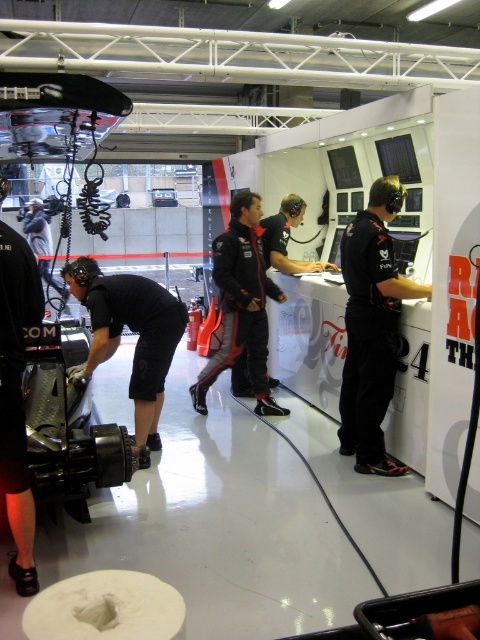
You are a race car driver who just finished a practice lap and need to locate the black matte mechanic at lower left for a quick consultation. Based on the coordinates provided, where should you look to find them?

The black matte mechanic at lower left is located at coordinates point (132, 330), so you should look towards the lower left area of the scene to find them.

You are a spectator at the race event and want to take a photo of the black matte suit at right and the black matte mechanic at lower left. To ensure both are in frame, should you adjust your camera upwards or downwards?

The black matte suit at right is located above the black matte mechanic at lower left, so you should adjust your camera upwards to include both in the frame.

You are a spectator at the race event and want to take a photo of the black matte mechanic at lower left and the black matte suit at center. Which one should you zoom in on more to capture both clearly in the frame?

The black matte mechanic at lower left is smaller in size compared to the black matte suit at center, so you should zoom in more on the black matte suit at center to ensure both fit clearly in the frame.